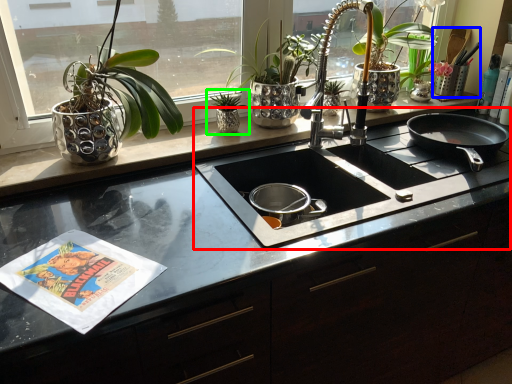
Question: Which object is positioned farthest from gas stove (highlighted by a red box)? Select from appliance (highlighted by a blue box) and houseplant (highlighted by a green box).

Choices:
 (A) appliance
 (B) houseplant

Answer: (A)